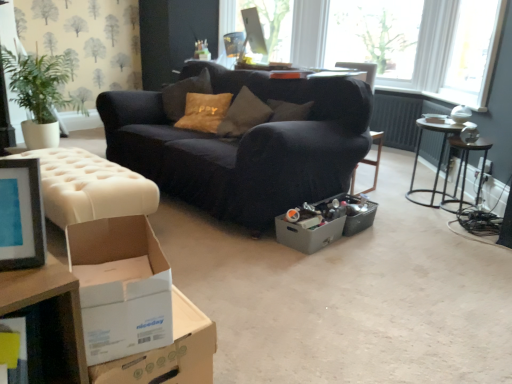
The image size is (512, 384). What are the coordinates of `free space that is to the left of metallic silver table at right, arranged as the 1th table when ordered from the bottom` in the screenshot? It's located at (380, 195).